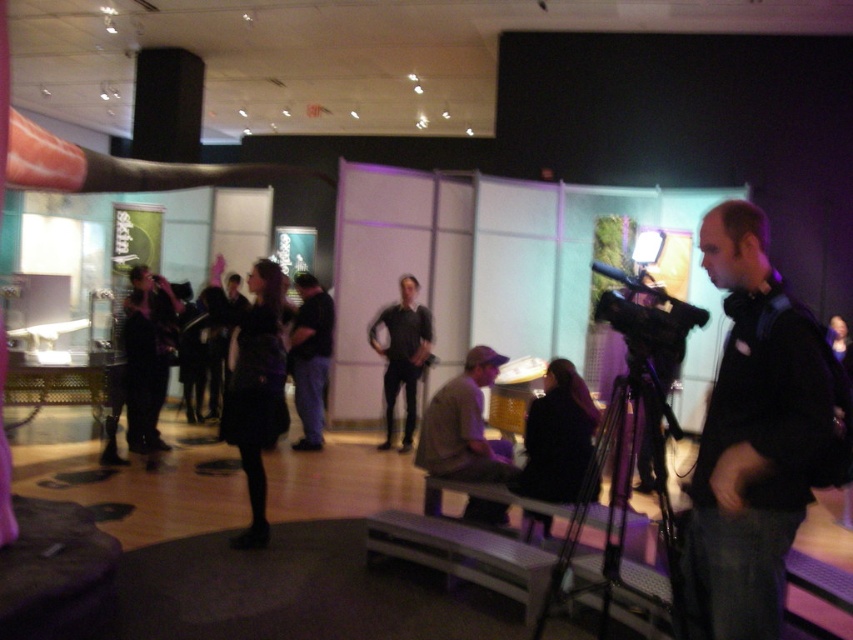
Which is in front, point (807, 432) or point (393, 371)?

Point (807, 432)

Does black matte jacket at right appear under matte black shirt at center?

Incorrect, black matte jacket at right is not positioned below matte black shirt at center.

Is point (730, 432) closer to viewer compared to point (419, 364)?

Yes.

Identify the location of black matte jacket at right. Image resolution: width=853 pixels, height=640 pixels. (755, 435).

Does black matte tripod at lower center have a greater width compared to black fabric dress at center?

Correct, the width of black matte tripod at lower center exceeds that of black fabric dress at center.

This screenshot has height=640, width=853. In order to click on black matte tripod at lower center in this screenshot , I will do `click(624, 515)`.

At what (x,y) coordinates should I click in order to perform the action: click on black matte tripod at lower center. Please return your answer as a coordinate pair (x, y). This screenshot has height=640, width=853. Looking at the image, I should click on (624, 515).

At what (x,y) coordinates should I click in order to perform the action: click on black matte tripod at lower center. Please return your answer as a coordinate pair (x, y). Looking at the image, I should click on (624, 515).

Who is lower down, black fabric dress at center or matte black dress at center?

Positioned lower is black fabric dress at center.

Is black fabric dress at center above matte black dress at center?

Incorrect, black fabric dress at center is not positioned above matte black dress at center.

What do you see at coordinates (253, 384) in the screenshot?
I see `black fabric dress at center` at bounding box center [253, 384].

You are a GUI agent. You are given a task and a screenshot of the screen. Output one action in this format:
    pyautogui.click(x=<x>, y=<y>)
    Task: Click on the black fabric dress at center
    The height and width of the screenshot is (640, 853).
    Given the screenshot: What is the action you would take?
    pyautogui.click(x=253, y=384)